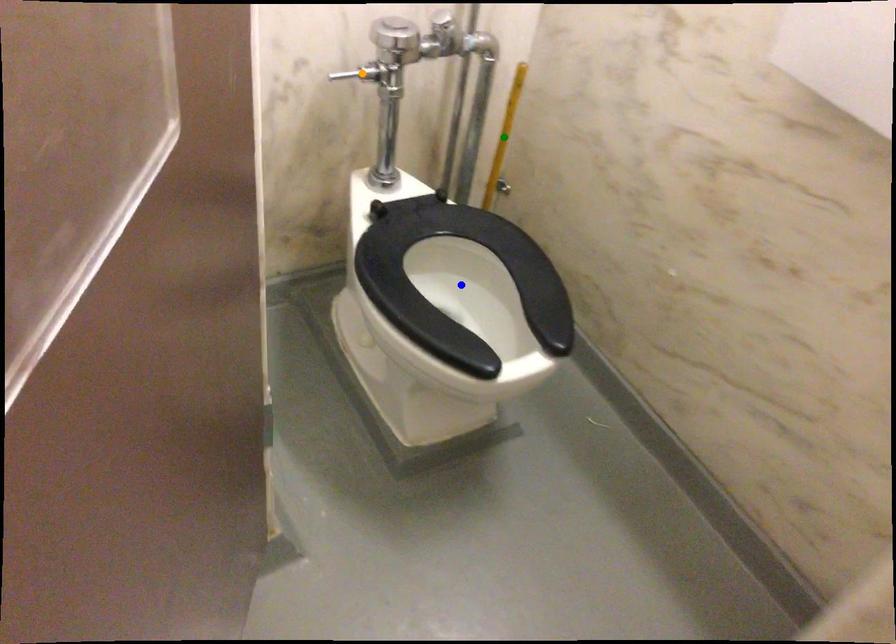
Order these from nearest to farthest:
A) blue point
B) orange point
C) green point

blue point, orange point, green point